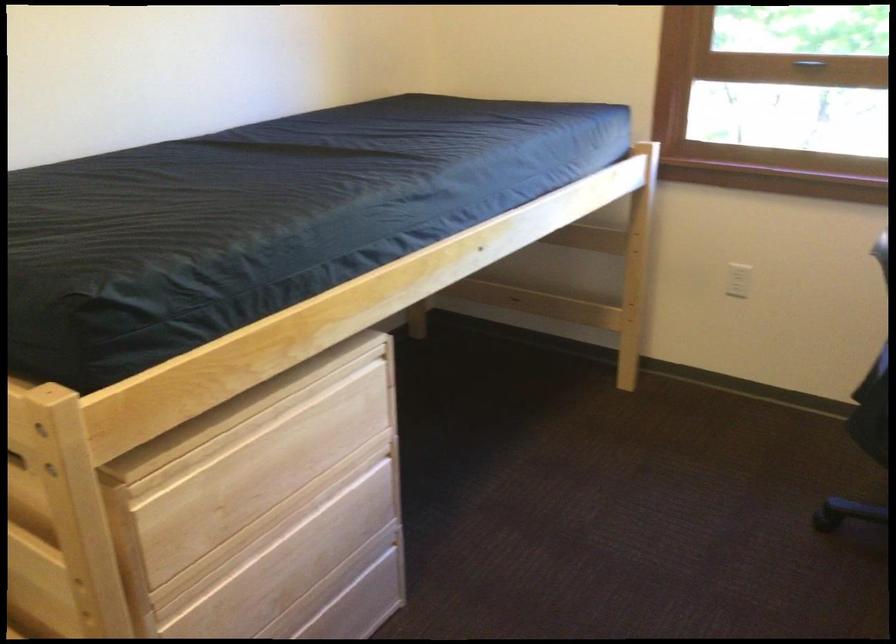
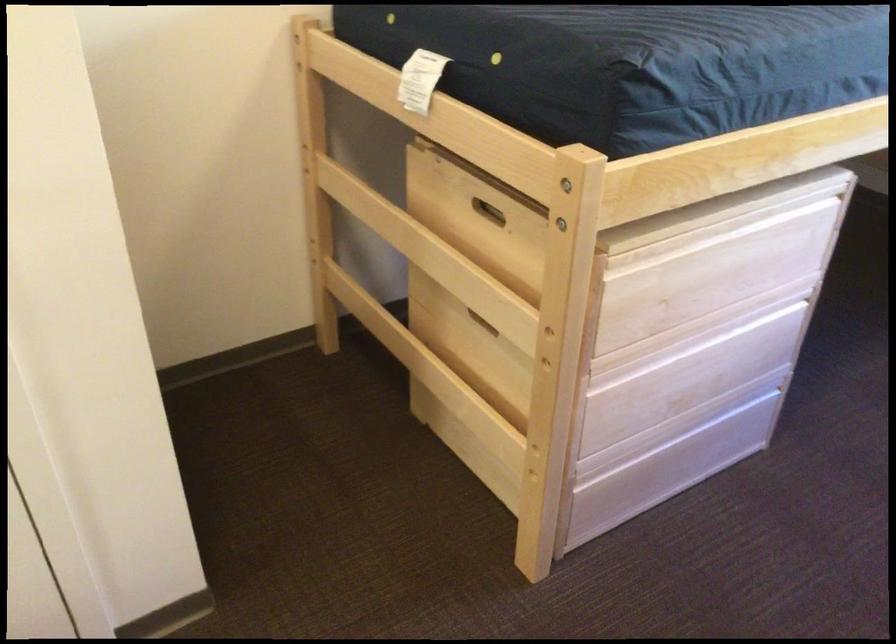
Locate, in the second image, the point that corresponds to (263,422) in the first image.

(720, 230)